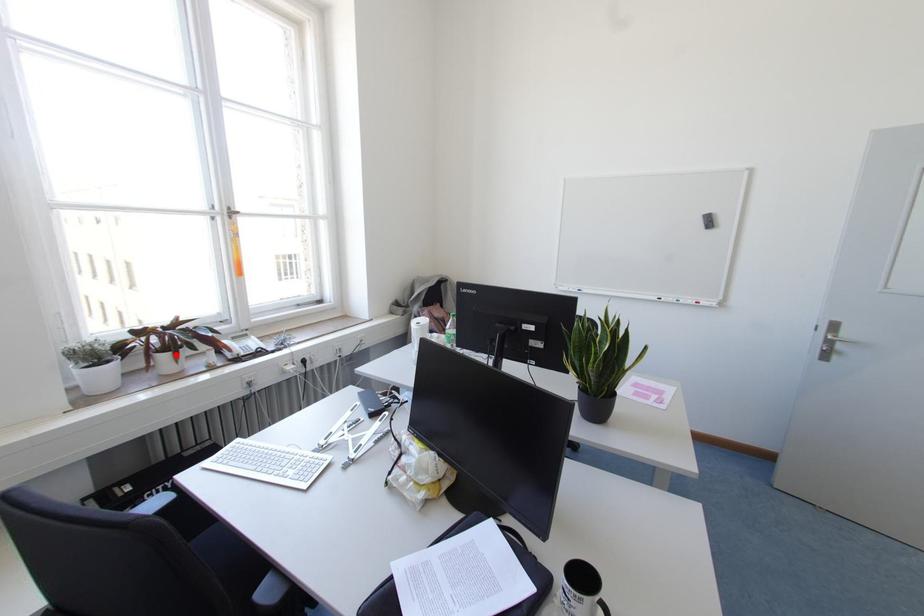
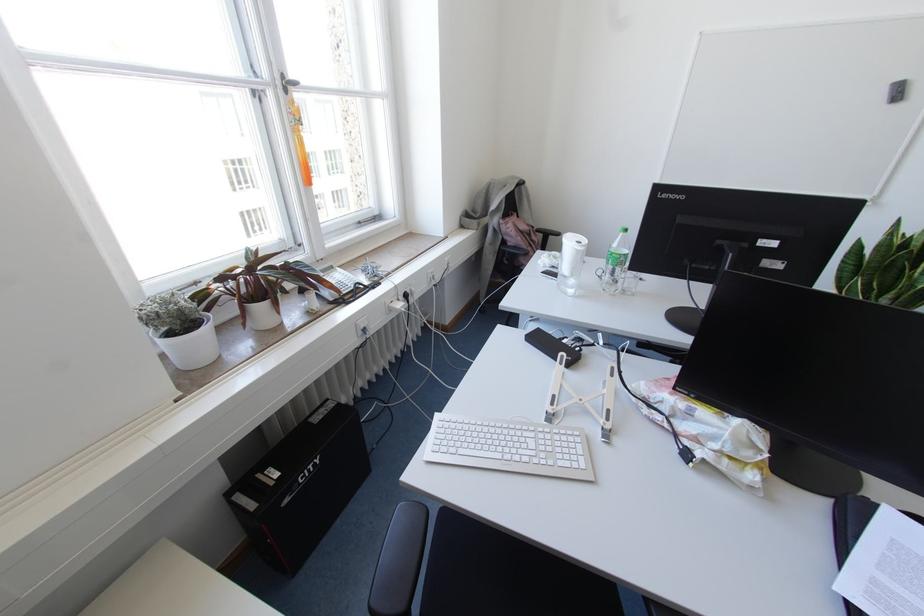
In the second image, find the point that corresponds to the highlighted location in the first image.

(274, 302)